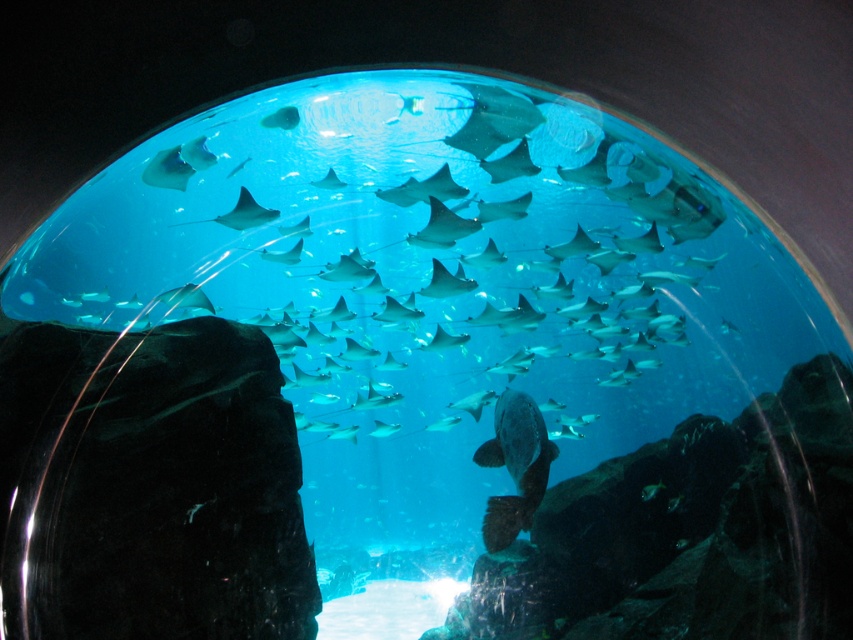
Does dark gray matte fish at center appear on the right side of translucent greenish-blue fish at center?

In fact, dark gray matte fish at center is to the left of translucent greenish-blue fish at center.

You are a GUI agent. You are given a task and a screenshot of the screen. Output one action in this format:
    pyautogui.click(x=<x>, y=<y>)
    Task: Click on the dark gray matte fish at center
    
    Given the screenshot: What is the action you would take?
    pyautogui.click(x=515, y=467)

Image resolution: width=853 pixels, height=640 pixels. Identify the location of dark gray matte fish at center. (515, 467).

Which of these two, dark gray matte fish at center or translucent blue fish at upper center, stands taller?

Standing taller between the two is dark gray matte fish at center.

Between dark gray matte fish at center and translucent blue fish at upper center, which one appears on the left side from the viewer's perspective?

translucent blue fish at upper center is more to the left.

Is point (524, 440) closer to viewer compared to point (265, 125)?

That is True.

Identify the location of dark gray matte fish at center. (515, 467).

Is point (509, 500) positioned in front of point (480, 115)?

No, (509, 500) is further to viewer.

Is dark gray matte fish at center taller than smooth gray stingray at upper center?

Yes, dark gray matte fish at center is taller than smooth gray stingray at upper center.

Identify the location of dark gray matte fish at center. The image size is (853, 640). (515, 467).